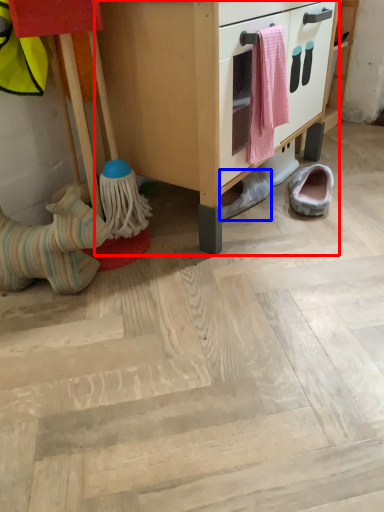
Question: Which of the following is the farthest to the observer, cabinetry (highlighted by a red box) or footwear (highlighted by a blue box)?

Choices:
 (A) cabinetry
 (B) footwear

Answer: (B)